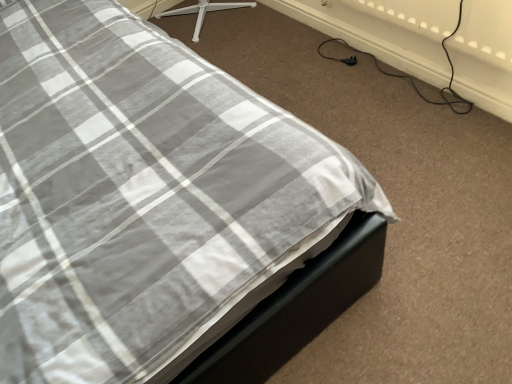
Find the location of a particular element. unoccupied region to the right of black plastic plug at lower right is located at coordinates (374, 57).